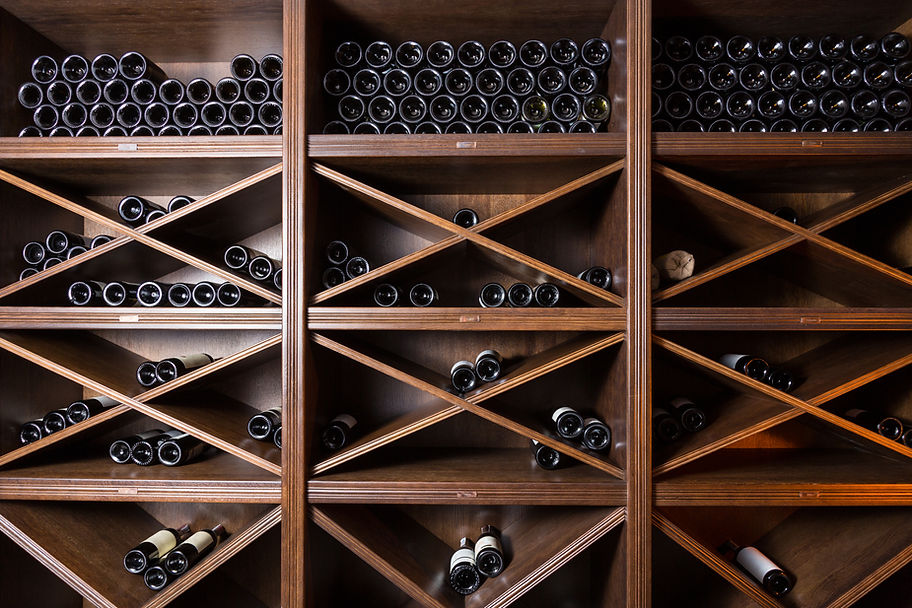
This screenshot has width=912, height=608. I want to click on shelf, so click(x=242, y=500), click(x=253, y=320), click(x=256, y=148), click(x=479, y=153), click(x=508, y=330), click(x=460, y=481), click(x=744, y=489), click(x=754, y=312), click(x=753, y=139).